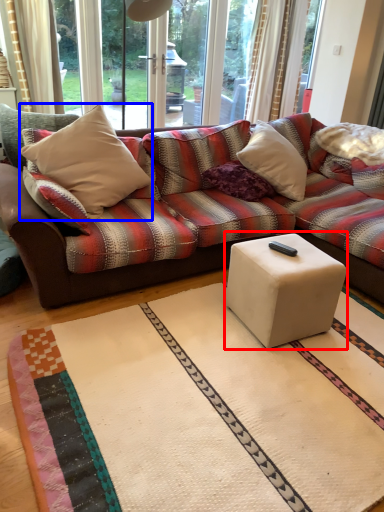
Question: Which object appears farthest to the camera in this image, coffee table (highlighted by a red box) or throw pillow (highlighted by a blue box)?

Choices:
 (A) coffee table
 (B) throw pillow

Answer: (B)